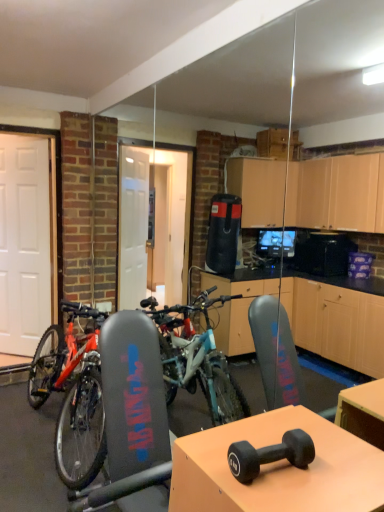
Locate an element on the screen. free spot in front of black rubber dumbbell at center is located at coordinates (281, 497).